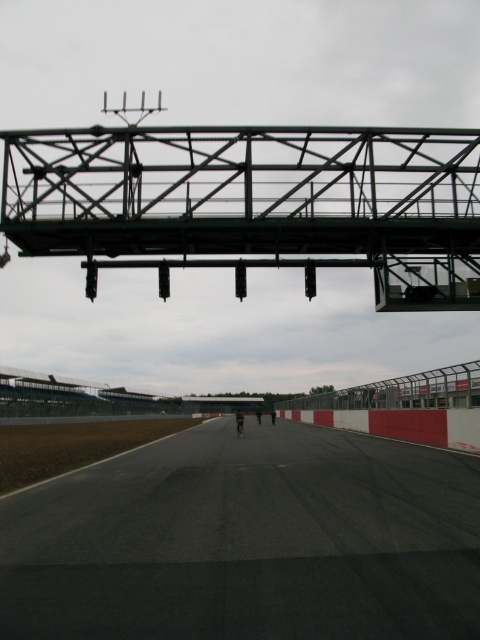
You are a drone operator who needs to land a drone on the black asphalt runway at center. The drone has a GPS coordinate system where the bottom left corner of the image is the origin point. What are the coordinates where you should direct the drone to land?

The coordinates for the black asphalt runway at center are at point (248, 541), so you should direct the drone to land there.

You are standing at the starting line of the racetrack and want to locate the green metallic overpass at upper center. According to the coordinates, where would you look relative to your position?

The green metallic overpass at upper center is located at coordinates 0.317 on the x axis and 0.531 on the y axis. Since you are at the starting line, you would look towards the upper center area of the image to find it.

You are a drone operator trying to land a drone on the black asphalt runway at center. The drone has a GPS coordinate of point (248, 541). Is this point on the black asphalt runway at center?

Yes, the point (248, 541) indicates the black asphalt runway at center, so the drone can land there.